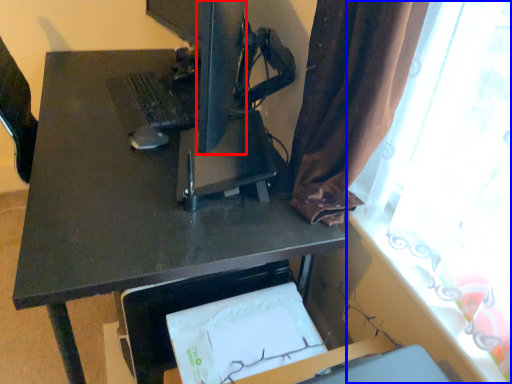
Question: Which object is closer to the camera taking this photo, computer monitor (highlighted by a red box) or curtain (highlighted by a blue box)?

Choices:
 (A) computer monitor
 (B) curtain

Answer: (B)